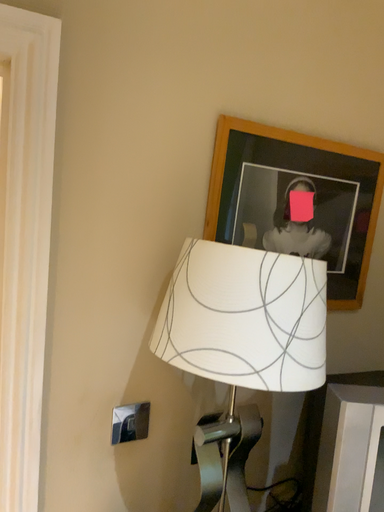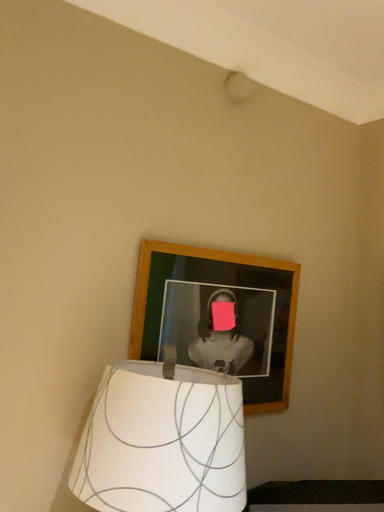
Question: Which way did the camera rotate in the video?

Choices:
 (A) rotated upward
 (B) rotated downward

Answer: (A)